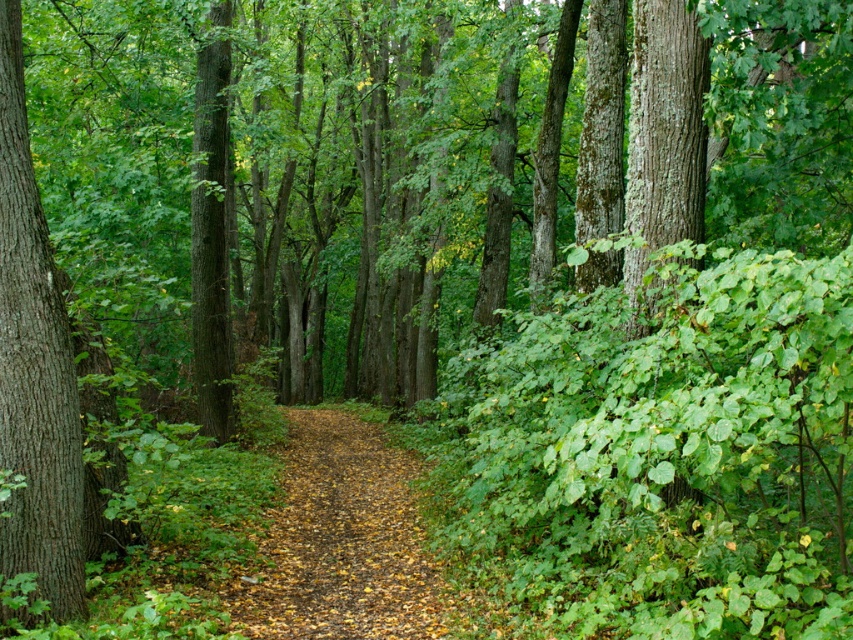
You are standing at the entrance of the forest and see the yellow leafy path at center. If you want to reach the path as quickly as possible, in which direction should you walk? Please answer with either north, south, east, or west.

The yellow leafy path at center is located at coordinates 0.848 on the x axis and 0.403 on the y axis. Since the path is at the center of the image, you should walk directly towards it, which would be straight ahead in the direction of the path.